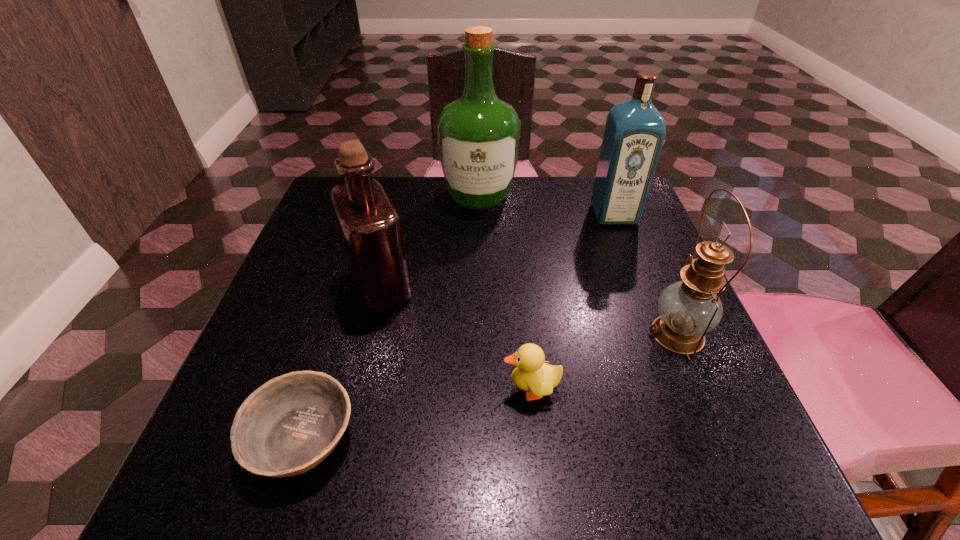
I want to click on vacant area situated on the left of the oil lamp, so click(517, 334).

The width and height of the screenshot is (960, 540). In order to click on free space located 0.380m on the front-facing side of the second shortest object in this screenshot , I will do `click(270, 389)`.

At what (x,y) coordinates should I click in order to perform the action: click on free region located 0.110m on the front-facing side of the second shortest object. Please return your answer as a coordinate pair (x, y). This screenshot has width=960, height=540. Looking at the image, I should click on [x=435, y=389].

Image resolution: width=960 pixels, height=540 pixels. Find the location of `free space located 0.400m on the front-facing side of the second shortest object`. free space located 0.400m on the front-facing side of the second shortest object is located at coordinates tap(257, 389).

At what (x,y) coordinates should I click in order to perform the action: click on vacant point located 0.050m on the left of the shortest object. Please return your answer as a coordinate pair (x, y). This screenshot has width=960, height=540. Looking at the image, I should click on click(x=214, y=437).

Locate an element on the screen. object positioned at the near edge is located at coordinates (286, 427).

Identify the location of liquor situated at the left edge. The width and height of the screenshot is (960, 540). (370, 229).

Locate an element on the screen. This screenshot has width=960, height=540. bowl that is at the left edge is located at coordinates (286, 427).

Image resolution: width=960 pixels, height=540 pixels. I want to click on liquor present at the right edge, so tap(635, 130).

Identify the location of oil lamp that is at the right edge. The width and height of the screenshot is (960, 540). (689, 309).